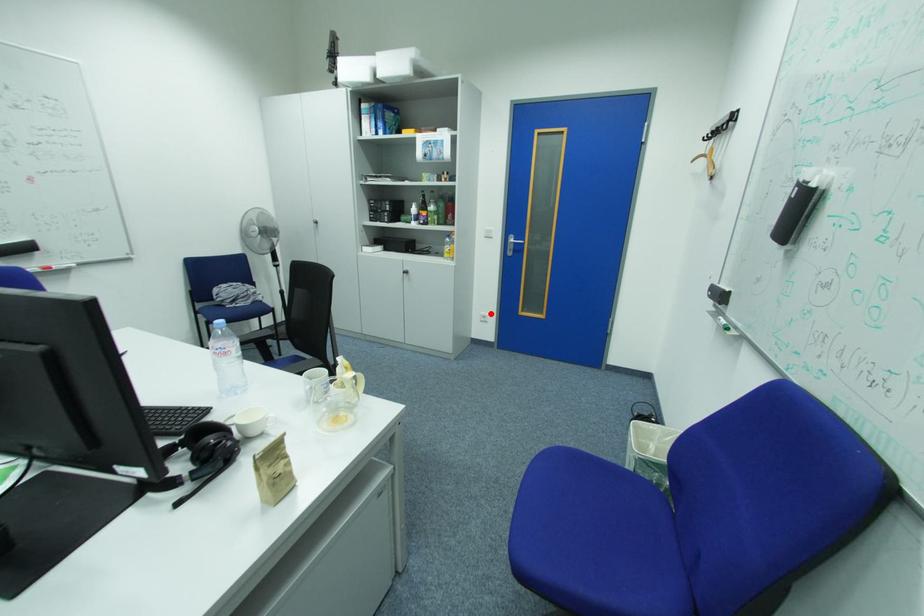
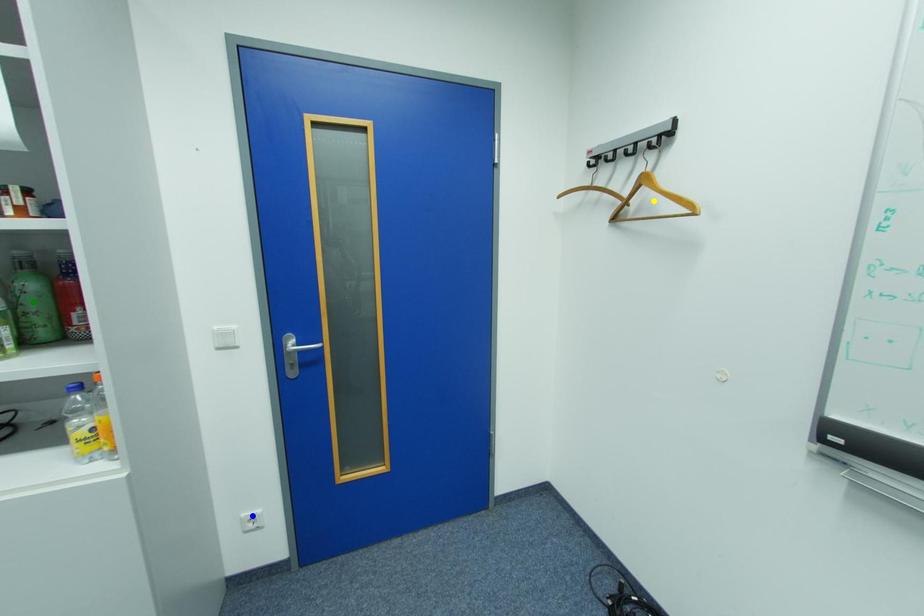
Question: I am providing you with two images of the same scene from different viewpoints. A red point is marked on the first image. You are given multiple points on the second image. Which point in image 2 represents the same 3d spot as the red point in image 1?

Choices:
 (A) yellow point
 (B) green point
 (C) blue point

Answer: (C)